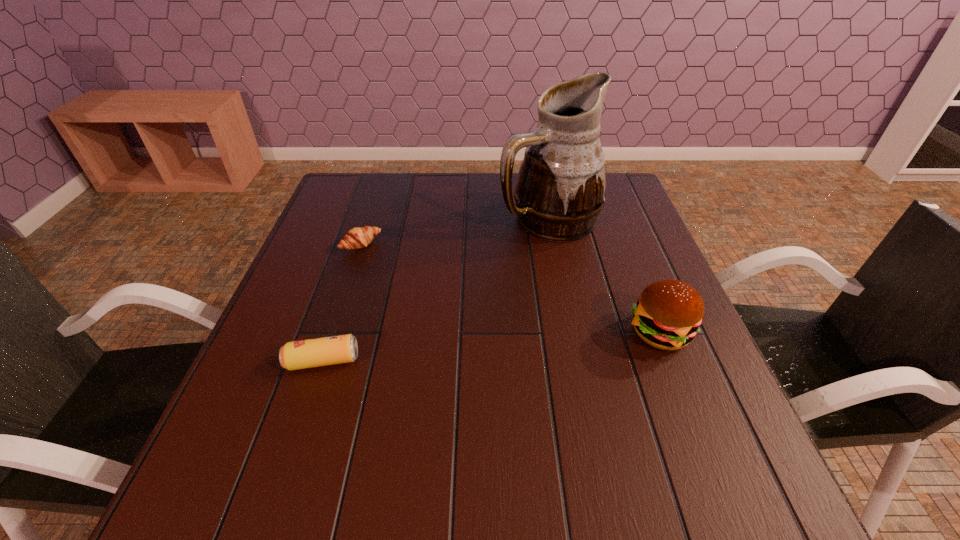
What are the coordinates of `free space located on the front-facing side of the pastry` in the screenshot? It's located at (450, 322).

At what (x,y) coordinates should I click in order to perform the action: click on vacant space located on the front-facing side of the pastry. Please return your answer as a coordinate pair (x, y). Image resolution: width=960 pixels, height=540 pixels. Looking at the image, I should click on (399, 277).

I want to click on object situated at the far edge, so click(560, 191).

Where is `beer can at the left edge`? This screenshot has width=960, height=540. beer can at the left edge is located at coordinates (325, 351).

At what (x,y) coordinates should I click in order to perform the action: click on pastry at the left edge. Please return your answer as a coordinate pair (x, y). The height and width of the screenshot is (540, 960). Looking at the image, I should click on (356, 238).

Where is `hamburger located in the right edge section of the desktop`? hamburger located in the right edge section of the desktop is located at coordinates (668, 314).

At what (x,y) coordinates should I click in order to perform the action: click on pitcher positioned at the right edge. Please return your answer as a coordinate pair (x, y). The height and width of the screenshot is (540, 960). Looking at the image, I should click on (560, 191).

This screenshot has width=960, height=540. I want to click on object that is at the far right corner, so 560,191.

Where is `vacant space at the far edge`? The width and height of the screenshot is (960, 540). vacant space at the far edge is located at coordinates (429, 189).

In the image, there is a desktop. Where is `vacant space at the near edge`? Image resolution: width=960 pixels, height=540 pixels. vacant space at the near edge is located at coordinates (504, 411).